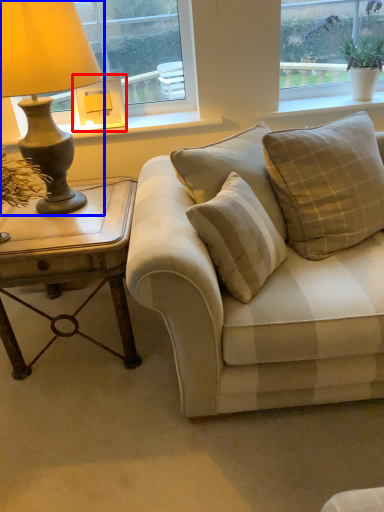
Question: Which point is closer to the camera, lamp (highlighted by a red box) or lamp (highlighted by a blue box)?

Choices:
 (A) lamp
 (B) lamp

Answer: (B)